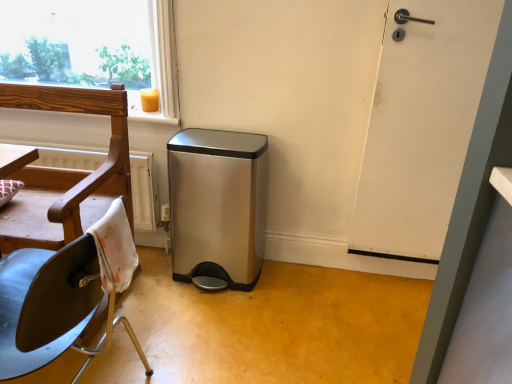
Locate an element on the screen. The height and width of the screenshot is (384, 512). wooden chair at left is located at coordinates (66, 172).

Identify the location of white matte door at right. The image size is (512, 384). coord(421,124).

Locate an element on the screen. The height and width of the screenshot is (384, 512). wooden chair at left is located at coordinates (66, 172).

Is satin steel trash can at center located within wooden chair at left?

No, satin steel trash can at center is located outside of wooden chair at left.

Which of these two, wooden chair at left or satin steel trash can at center, is wider?

Wider between the two is wooden chair at left.

Is wooden chair at left far away from satin steel trash can at center?

Actually, wooden chair at left and satin steel trash can at center are a little close together.

Does satin steel trash can at center turn towards wooden chair at left?

No, satin steel trash can at center is not facing towards wooden chair at left.

Is satin steel trash can at center beside wooden chair at left?

They are not placed beside each other.

From the picture: Which is more to the right, satin steel trash can at center or wooden chair at left?

From the viewer's perspective, satin steel trash can at center appears more on the right side.

How different are the orientations of satin steel trash can at center and wooden chair at left in degrees?

The angular difference between satin steel trash can at center and wooden chair at left is 4.32 degrees.

In the image, is satin steel trash can at center on the left side or the right side of white matte door at right?

In the image, satin steel trash can at center appears on the left side of white matte door at right.

Which point is more forward, (x=193, y=239) or (x=452, y=202)?

Point (x=452, y=202)

Which of these two, satin steel trash can at center or white matte door at right, stands shorter?

With less height is satin steel trash can at center.

Would you say satin steel trash can at center is inside or outside white matte door at right?

satin steel trash can at center exists outside the volume of white matte door at right.

Is wooden chair at left to the left or to the right of white matte door at right in the image?

Clearly, wooden chair at left is on the left of white matte door at right in the image.

At what (x,y) coordinates should I click in order to perform the action: click on door located above the wooden chair at left (from the image's perspective). Please return your answer as a coordinate pair (x, y). This screenshot has width=512, height=384. Looking at the image, I should click on (421, 124).

Which object is thinner, wooden chair at left or white matte door at right?

white matte door at right is thinner.

Is point (17, 233) closer to viewer compared to point (481, 55)?

Yes, point (17, 233) is closer to viewer.

Can you confirm if white matte door at right is thinner than satin steel trash can at center?

Correct, the width of white matte door at right is less than that of satin steel trash can at center.

Considering the relative positions of white matte door at right and satin steel trash can at center in the image provided, is white matte door at right in front of satin steel trash can at center?

Yes, white matte door at right is closer to the viewer.

Is white matte door at right positioned far away from satin steel trash can at center?

No.

Is white matte door at right positioned with its back to satin steel trash can at center?

No.

Is white matte door at right oriented away from wooden chair at left?

white matte door at right does not have its back to wooden chair at left.

Is white matte door at right touching wooden chair at left?

They are not placed beside each other.

Choose the correct answer: Is white matte door at right inside wooden chair at left or outside it?

white matte door at right is located beyond the bounds of wooden chair at left.

From the image's perspective, is white matte door at right located above wooden chair at left?

Yes, from the image's perspective, white matte door at right is on top of wooden chair at left.

Locate an element on the screen. dish washer directly beneath the wooden chair at left (from a real-world perspective) is located at coordinates (218, 205).

Where is `chair in front of the satin steel trash can at center`? chair in front of the satin steel trash can at center is located at coordinates (66, 172).

Based on their spatial positions, is wooden chair at left or white matte door at right further from satin steel trash can at center?

Based on the image, white matte door at right appears to be further to satin steel trash can at center.

Estimate the real-world distances between objects in this image. Which object is closer to wooden chair at left, satin steel trash can at center or white matte door at right?

Based on the image, satin steel trash can at center appears to be nearer to wooden chair at left.

Considering their positions, is wooden chair at left positioned further to white matte door at right than satin steel trash can at center?

Among the two, wooden chair at left is located further to white matte door at right.

When comparing their distances from satin steel trash can at center, does white matte door at right or wooden chair at left seem closer?

wooden chair at left lies closer to satin steel trash can at center than the other object.

Considering their positions, is satin steel trash can at center positioned closer to white matte door at right than wooden chair at left?

Based on the image, satin steel trash can at center appears to be nearer to white matte door at right.

Which object lies further to the anchor point wooden chair at left, white matte door at right or satin steel trash can at center?

white matte door at right is positioned further to the anchor wooden chair at left.

Identify the location of dish washer between wooden chair at left and white matte door at right. (218, 205).